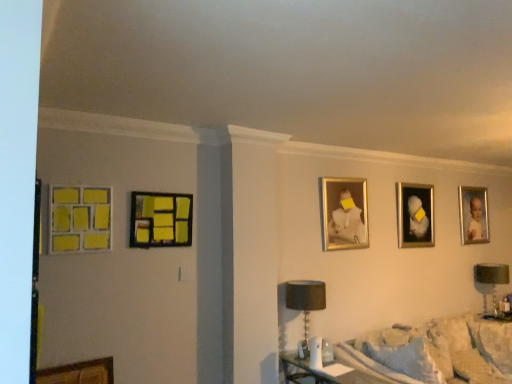
The image size is (512, 384). In order to click on green fabric lampshade at right, positioned as the 1th table lamp in right-to-left order in this screenshot , I will do `click(492, 277)`.

Find the location of a particular element. Image resolution: width=512 pixels, height=384 pixels. gold-framed portrait at upper right, positioned as the 4th picture frame in left-to-right order is located at coordinates pyautogui.click(x=415, y=215).

Describe the element at coordinates (415, 215) in the screenshot. I see `gold-framed portrait at upper right, positioned as the 4th picture frame in left-to-right order` at that location.

At what (x,y) coordinates should I click in order to perform the action: click on fluffy white blanket at lower right. Please return your answer as a coordinate pair (x, y). The width and height of the screenshot is (512, 384). Looking at the image, I should click on (419, 356).

Describe the element at coordinates (160, 220) in the screenshot. I see `matte wood picture frame at left, acting as the fourth picture frame starting from the back` at that location.

Find the location of a particular element. This screenshot has width=512, height=384. matte yellow tiles at left, the fifth picture frame viewed from the back is located at coordinates (79, 219).

This screenshot has height=384, width=512. I want to click on gold-framed portrait at upper right, arranged as the 1th picture frame when viewed from the right, so click(474, 215).

This screenshot has width=512, height=384. In order to click on green fabric lampshade at right, which is counted as the 2th table lamp, starting from the front in this screenshot , I will do `click(492, 277)`.

Which of these two, matte wood picture frame at left, acting as the fourth picture frame starting from the back, or matte yellow tiles at left, the fifth picture frame viewed from the back, stands taller?

Standing taller between the two is matte yellow tiles at left, the fifth picture frame viewed from the back.

Is matte wood picture frame at left, the fourth picture frame viewed from the right, oriented towards matte yellow tiles at left, acting as the 5th picture frame starting from the right?

No, matte wood picture frame at left, the fourth picture frame viewed from the right, is not facing towards matte yellow tiles at left, acting as the 5th picture frame starting from the right.

Considering the relative sizes of matte wood picture frame at left, the fourth picture frame viewed from the right, and matte yellow tiles at left, the 1th picture frame from the front, in the image provided, is matte wood picture frame at left, the fourth picture frame viewed from the right, wider than matte yellow tiles at left, the 1th picture frame from the front,?

Yes, matte wood picture frame at left, the fourth picture frame viewed from the right, is wider than matte yellow tiles at left, the 1th picture frame from the front.

From a real-world perspective, is matte wood picture frame at left, the 2th picture frame in the left-to-right sequence, positioned over matte yellow tiles at left, acting as the 5th picture frame starting from the right, based on gravity?

No, from a real-world perspective, matte wood picture frame at left, the 2th picture frame in the left-to-right sequence, is not above matte yellow tiles at left, acting as the 5th picture frame starting from the right.

This screenshot has height=384, width=512. I want to click on the 3rd picture frame behind when counting from the matte yellow tiles at left, the fifth picture frame viewed from the back, so click(x=415, y=215).

From the image's perspective, does gold-framed portrait at upper right, which ranks as the second picture frame in right-to-left order, appear lower than matte yellow tiles at left, acting as the 5th picture frame starting from the right?

Indeed, from the image's perspective, gold-framed portrait at upper right, which ranks as the second picture frame in right-to-left order, is shown beneath matte yellow tiles at left, acting as the 5th picture frame starting from the right.

How different are the orientations of gold-framed portrait at upper right, positioned as the second picture frame in back-to-front order, and matte yellow tiles at left, the fifth picture frame viewed from the back, in degrees?

gold-framed portrait at upper right, positioned as the second picture frame in back-to-front order, and matte yellow tiles at left, the fifth picture frame viewed from the back, are facing 1.33 degrees away from each other.

How distant is gold-framed portrait at upper right, which appears as the 4th picture frame when viewed from the front, from matte yellow tiles at left, acting as the 5th picture frame starting from the right?

gold-framed portrait at upper right, which appears as the 4th picture frame when viewed from the front, is 8.82 feet away from matte yellow tiles at left, acting as the 5th picture frame starting from the right.

Is the surface of matte yellow tiles at left, the 1th picture frame viewed from the left, in direct contact with fluffy white blanket at lower right?

No, matte yellow tiles at left, the 1th picture frame viewed from the left, is not in contact with fluffy white blanket at lower right.

Which object is closer to the camera taking this photo, matte yellow tiles at left, the 1th picture frame from the front, or fluffy white blanket at lower right?

matte yellow tiles at left, the 1th picture frame from the front, is closer to the camera.

Can you confirm if matte yellow tiles at left, acting as the 5th picture frame starting from the right, is wider than fluffy white blanket at lower right?

In fact, matte yellow tiles at left, acting as the 5th picture frame starting from the right, might be narrower than fluffy white blanket at lower right.

Can we say matte yellow tiles at left, the fifth picture frame viewed from the back, lies outside fluffy white blanket at lower right?

Yes, matte yellow tiles at left, the fifth picture frame viewed from the back, is outside of fluffy white blanket at lower right.

Is green fabric lampshade at right, which is counted as the 2th table lamp, starting from the front, placed right next to gold-framed portrait at center-right, which is counted as the third picture frame, starting from the front?

green fabric lampshade at right, which is counted as the 2th table lamp, starting from the front, and gold-framed portrait at center-right, which is counted as the third picture frame, starting from the front, are not in contact.

Who is smaller, green fabric lampshade at right, positioned as the 1th table lamp in right-to-left order, or gold-framed portrait at center-right, which is counted as the third picture frame, starting from the back?

gold-framed portrait at center-right, which is counted as the third picture frame, starting from the back.

Does point (493, 280) come in front of point (357, 212)?

No.

Can you tell me how much green fabric lampshade at right, the first table lamp viewed from the back, and matte wood picture frame at left, marked as the second picture frame in a front-to-back arrangement, differ in facing direction?

green fabric lampshade at right, the first table lamp viewed from the back, and matte wood picture frame at left, marked as the second picture frame in a front-to-back arrangement, are facing 1.89 degrees away from each other.

Is point (495, 289) behind point (167, 207)?

Yes.

From a real-world perspective, relative to matte wood picture frame at left, the fourth picture frame viewed from the right, is green fabric lampshade at right, acting as the second table lamp starting from the left, vertically above or below?

green fabric lampshade at right, acting as the second table lamp starting from the left, is situated lower than matte wood picture frame at left, the fourth picture frame viewed from the right, in the real world.

Which object is closer to the camera, green fabric lampshade at right, acting as the second table lamp starting from the left, or matte wood picture frame at left, the 2th picture frame in the left-to-right sequence?

Positioned in front is matte wood picture frame at left, the 2th picture frame in the left-to-right sequence.

Considering the relative positions of matte yellow tiles at left, acting as the 5th picture frame starting from the right, and gold-framed portrait at center-right, placed as the 3th picture frame when sorted from right to left, in the image provided, is matte yellow tiles at left, acting as the 5th picture frame starting from the right, behind gold-framed portrait at center-right, placed as the 3th picture frame when sorted from right to left,?

No.

Between point (63, 238) and point (337, 240), which one is positioned in front?

Positioned in front is point (63, 238).

From the image's perspective, does matte yellow tiles at left, the 1th picture frame viewed from the left, appear lower than gold-framed portrait at center-right, which is counted as the third picture frame, starting from the front?

Incorrect, from the image's perspective, matte yellow tiles at left, the 1th picture frame viewed from the left, is higher than gold-framed portrait at center-right, which is counted as the third picture frame, starting from the front.

Considering the sizes of matte yellow tiles at left, the fifth picture frame viewed from the back, and gold-framed portrait at center-right, which is counted as the third picture frame, starting from the front, in the image, is matte yellow tiles at left, the fifth picture frame viewed from the back, taller or shorter than gold-framed portrait at center-right, which is counted as the third picture frame, starting from the front,?

Considering their sizes, matte yellow tiles at left, the fifth picture frame viewed from the back, has less height than gold-framed portrait at center-right, which is counted as the third picture frame, starting from the front.

From the image's perspective, which is below, gold-framed portrait at upper right, positioned as the fifth picture frame in left-to-right order, or matte wood picture frame at left, the 2th picture frame in the left-to-right sequence?

From the image's view, gold-framed portrait at upper right, positioned as the fifth picture frame in left-to-right order, is below.

Is gold-framed portrait at upper right, marked as the 5th picture frame in a front-to-back arrangement, located outside matte wood picture frame at left, marked as the second picture frame in a front-to-back arrangement?

That's correct, gold-framed portrait at upper right, marked as the 5th picture frame in a front-to-back arrangement, is outside of matte wood picture frame at left, marked as the second picture frame in a front-to-back arrangement.

Is gold-framed portrait at upper right, positioned as the fifth picture frame in left-to-right order, with matte wood picture frame at left, the fourth picture frame viewed from the right?

gold-framed portrait at upper right, positioned as the fifth picture frame in left-to-right order, is not next to matte wood picture frame at left, the fourth picture frame viewed from the right, and they're not touching.

Looking at this image, between gold-framed portrait at upper right, which ranks as the 1th picture frame in back-to-front order, and matte wood picture frame at left, marked as the second picture frame in a front-to-back arrangement, which one appears on the left side from the viewer's perspective?

matte wood picture frame at left, marked as the second picture frame in a front-to-back arrangement, is more to the left.

From the image's perspective, starting from the matte yellow tiles at left, the 1th picture frame from the front, which picture frame is the 2nd one below? Please provide its 2D coordinates.

[(160, 220)]

Find the location of a particular element. the 3rd picture frame counting from the right side of the matte yellow tiles at left, acting as the 5th picture frame starting from the right is located at coordinates (415, 215).

Based on their spatial positions, is matte wood picture frame at left, acting as the fourth picture frame starting from the back, or green fabric lampshade at right, positioned as the 1th table lamp in right-to-left order, closer to fluffy white blanket at lower right?

green fabric lampshade at right, positioned as the 1th table lamp in right-to-left order, lies closer to fluffy white blanket at lower right than the other object.

Considering their positions, is gold-framed portrait at upper right, which ranks as the 1th picture frame in back-to-front order, positioned further to fluffy white blanket at lower right than gold-framed portrait at upper right, positioned as the second picture frame in back-to-front order?

Among the two, gold-framed portrait at upper right, which ranks as the 1th picture frame in back-to-front order, is located further to fluffy white blanket at lower right.

Considering their positions, is black fabric lampshade at lower center, the 2th table lamp in the right-to-left sequence, positioned closer to gold-framed portrait at upper right, arranged as the 1th picture frame when viewed from the right, than fluffy white blanket at lower right?

fluffy white blanket at lower right is closer to gold-framed portrait at upper right, arranged as the 1th picture frame when viewed from the right.

Based on their spatial positions, is green fabric lampshade at right, positioned as the 1th table lamp in right-to-left order, or fluffy white blanket at lower right further from gold-framed portrait at center-right, the 3th picture frame when ordered from left to right?

green fabric lampshade at right, positioned as the 1th table lamp in right-to-left order, is positioned further to the anchor gold-framed portrait at center-right, the 3th picture frame when ordered from left to right.

From the image, which object appears to be farther from matte wood picture frame at left, the fourth picture frame viewed from the right, gold-framed portrait at upper right, which appears as the 4th picture frame when viewed from the front, or black fabric lampshade at lower center, the 1th table lamp in the front-to-back sequence?

Based on the image, gold-framed portrait at upper right, which appears as the 4th picture frame when viewed from the front, appears to be further to matte wood picture frame at left, the fourth picture frame viewed from the right.

When comparing their distances from fluffy white blanket at lower right, does black fabric lampshade at lower center, the 1th table lamp in the front-to-back sequence, or gold-framed portrait at upper right, which ranks as the second picture frame in right-to-left order, seem closer?

The object closer to fluffy white blanket at lower right is gold-framed portrait at upper right, which ranks as the second picture frame in right-to-left order.

Considering their positions, is fluffy white blanket at lower right positioned closer to black fabric lampshade at lower center, the 1th table lamp in the front-to-back sequence, than matte wood picture frame at left, acting as the fourth picture frame starting from the back?

Based on the image, matte wood picture frame at left, acting as the fourth picture frame starting from the back, appears to be nearer to black fabric lampshade at lower center, the 1th table lamp in the front-to-back sequence.

Estimate the real-world distances between objects in this image. Which object is further from black fabric lampshade at lower center, the second table lamp in the back-to-front sequence, gold-framed portrait at upper right, positioned as the fifth picture frame in left-to-right order, or matte yellow tiles at left, the fifth picture frame viewed from the back?

gold-framed portrait at upper right, positioned as the fifth picture frame in left-to-right order, lies further to black fabric lampshade at lower center, the second table lamp in the back-to-front sequence, than the other object.

I want to click on furniture between black fabric lampshade at lower center, arranged as the first table lamp when viewed from the left, and green fabric lampshade at right, positioned as the 1th table lamp in right-to-left order, in the horizontal direction, so click(419, 356).

Image resolution: width=512 pixels, height=384 pixels. I want to click on table lamp between matte wood picture frame at left, marked as the second picture frame in a front-to-back arrangement, and gold-framed portrait at center-right, the 3th picture frame when ordered from left to right, in the horizontal direction, so click(305, 304).

At what (x,y) coordinates should I click in order to perform the action: click on table lamp situated between matte wood picture frame at left, the 2th picture frame in the left-to-right sequence, and green fabric lampshade at right, positioned as the 1th table lamp in right-to-left order, from left to right. Please return your answer as a coordinate pair (x, y). The image size is (512, 384). Looking at the image, I should click on (305, 304).

I want to click on picture frame between matte yellow tiles at left, the 1th picture frame viewed from the left, and gold-framed portrait at center-right, placed as the 3th picture frame when sorted from right to left, in the horizontal direction, so click(160, 220).